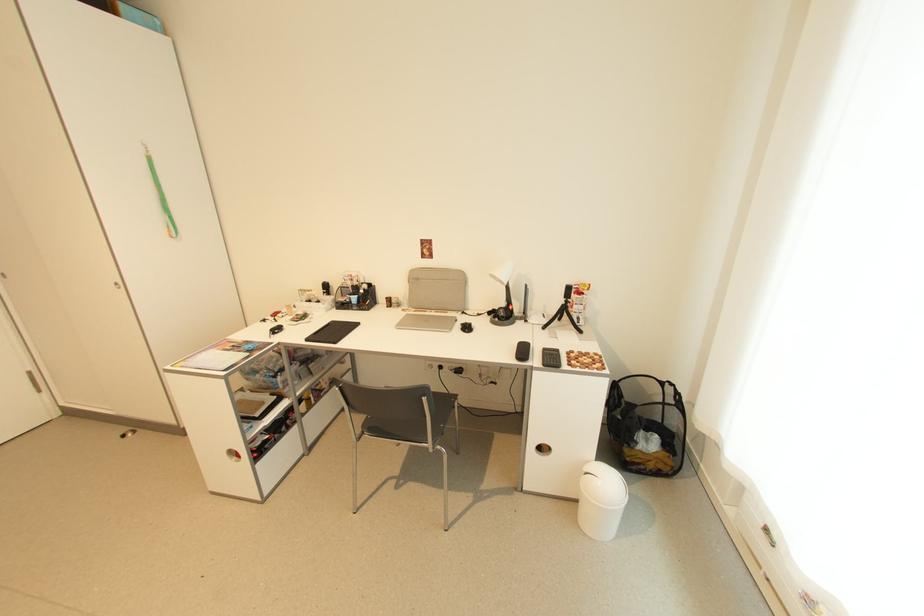
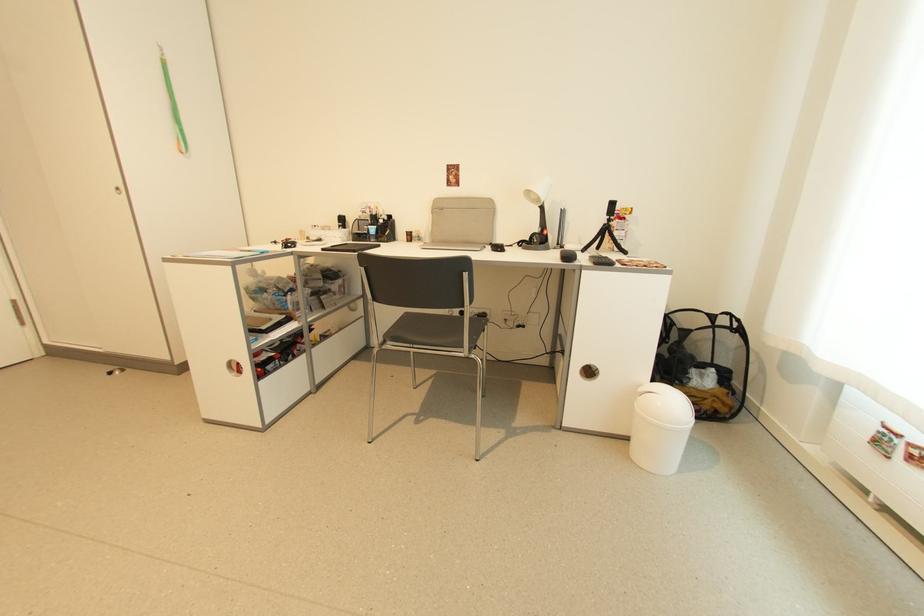
Where in the second image is the point corresponding to pixel 568 299 from the first image?

(612, 217)